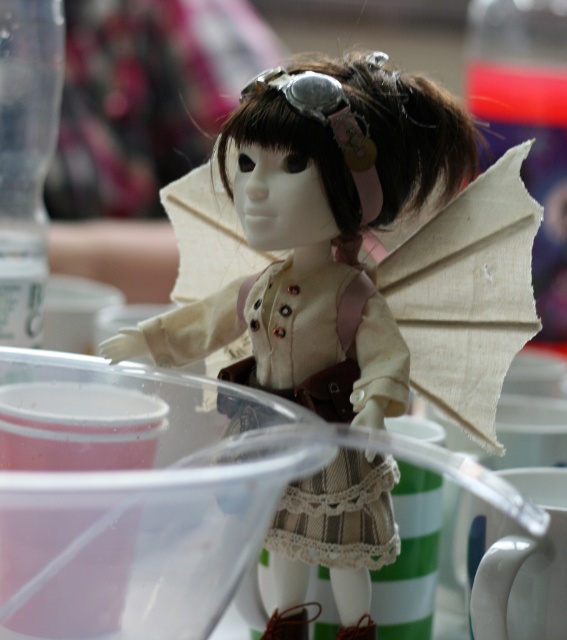
Is striped cotton dress at center further to the viewer compared to green striped mug at center?

That is False.

Is striped cotton dress at center above green striped mug at center?

Correct, striped cotton dress at center is located above green striped mug at center.

Between point (376, 538) and point (404, 509), which one is positioned in front?

Point (376, 538) is more forward.

This screenshot has height=640, width=567. Find the location of `striped cotton dress at center`. striped cotton dress at center is located at coordinates (319, 339).

From the picture: Is beige fabric wings at center positioned at the back of green striped mug at center?

No.

Is beige fabric wings at center closer to the viewer compared to green striped mug at center?

Yes, beige fabric wings at center is in front of green striped mug at center.

Is point (441, 385) closer to camera compared to point (422, 628)?

That is True.

Identify the location of beige fabric wings at center. (463, 291).

In order to click on white ceramic mug at lower right in this screenshot , I will do `click(519, 564)`.

Measure the distance between white ceramic mug at lower right and camera.

white ceramic mug at lower right is 26.88 inches from camera.

You are a GUI agent. You are given a task and a screenshot of the screen. Output one action in this format:
    pyautogui.click(x=<x>, y=<y>)
    Task: Click on the white ceramic mug at lower right
    The width and height of the screenshot is (567, 640).
    Given the screenshot: What is the action you would take?
    pyautogui.click(x=519, y=564)